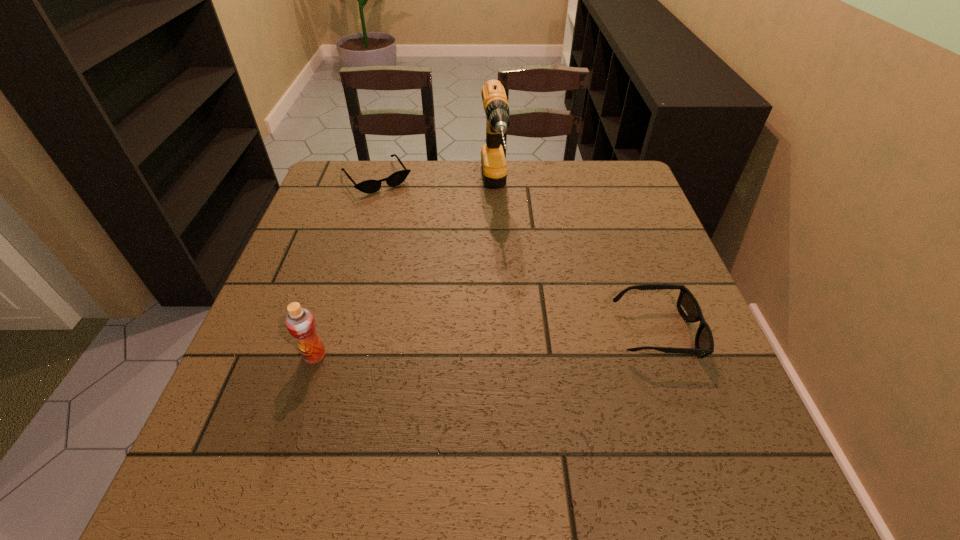
Image resolution: width=960 pixels, height=540 pixels. I want to click on orange juice, so click(300, 322).

Locate an element on the screen. The image size is (960, 540). the rightmost object is located at coordinates (687, 305).

This screenshot has width=960, height=540. What are the coordinates of `the nearer sunglasses` in the screenshot? It's located at (687, 305).

Identify the location of drill. The height and width of the screenshot is (540, 960). (495, 102).

The image size is (960, 540). I want to click on the third object from left to right, so click(x=495, y=102).

Locate an element on the screen. The width and height of the screenshot is (960, 540). the shorter sunglasses is located at coordinates (368, 186).

Identify the location of the shortest object. This screenshot has width=960, height=540. (368, 186).

The image size is (960, 540). Identify the location of free space located 0.380m on the right of the orange juice. 523,356.

At what (x,y) coordinates should I click in order to perform the action: click on vacant area located 0.130m at the tip of the drill. Please return your answer as a coordinate pair (x, y). This screenshot has width=960, height=540. Looking at the image, I should click on (502, 263).

This screenshot has width=960, height=540. Find the location of `vacant space situated 0.400m at the tip of the drill`. vacant space situated 0.400m at the tip of the drill is located at coordinates (516, 359).